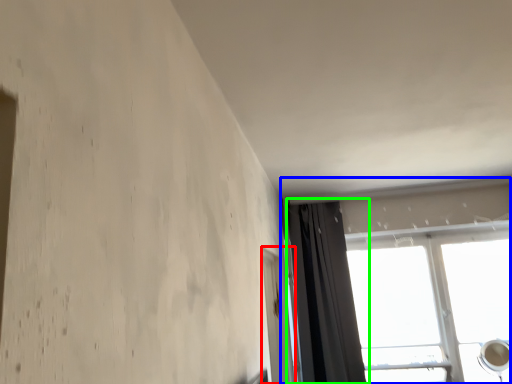
Question: Which is farther away from screen door (highlighted by a red box)? window (highlighted by a blue box) or curtain (highlighted by a green box)?

Choices:
 (A) window
 (B) curtain

Answer: (A)